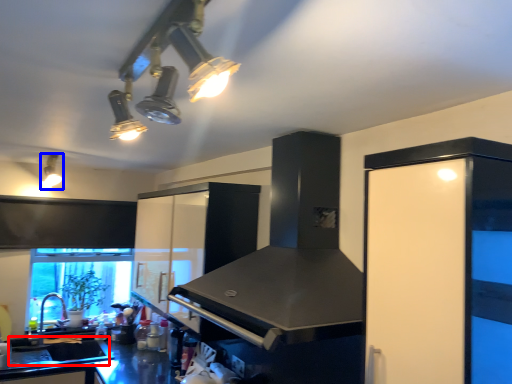
Question: Among these objects, which one is nearest to the camera, sink (highlighted by a red box) or light fixture (highlighted by a blue box)?

Choices:
 (A) sink
 (B) light fixture

Answer: (B)